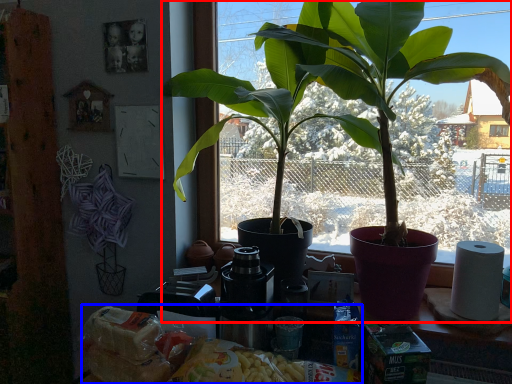
Question: Which object is further to the camera taking this photo, houseplant (highlighted by a red box) or food (highlighted by a blue box)?

Choices:
 (A) houseplant
 (B) food

Answer: (A)